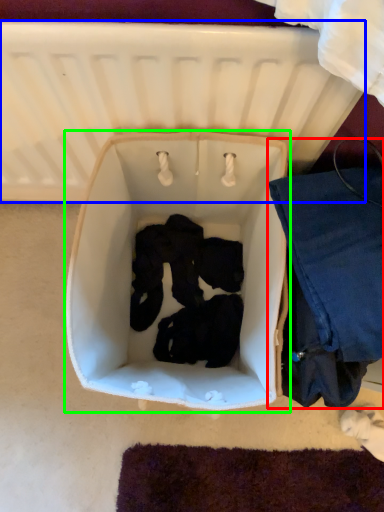
Question: Based on their relative distances, which object is farther from clothing (highlighted by a red box)? Choose from infant bed (highlighted by a blue box) and baby carriage (highlighted by a green box).

Choices:
 (A) infant bed
 (B) baby carriage

Answer: (A)